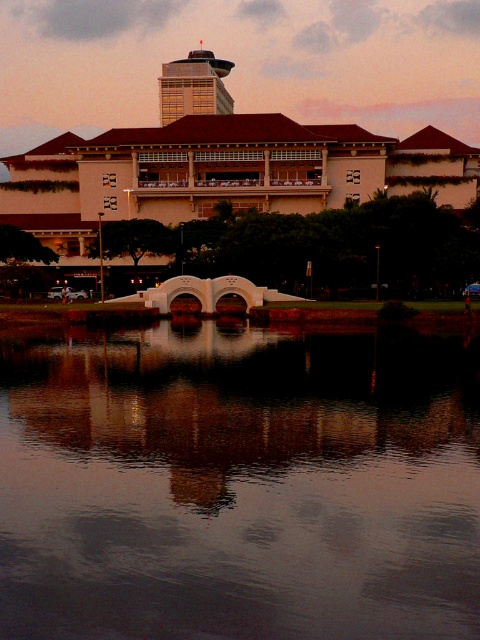
Between smooth reflective water at center and matte beige building at center, which one appears on the left side from the viewer's perspective?

From the viewer's perspective, matte beige building at center appears more on the left side.

How far apart are smooth reflective water at center and matte beige building at center?

smooth reflective water at center and matte beige building at center are 73.11 meters apart from each other.

What do you see at coordinates (239, 483) in the screenshot? I see `smooth reflective water at center` at bounding box center [239, 483].

This screenshot has height=640, width=480. Identify the location of smooth reflective water at center. (239, 483).